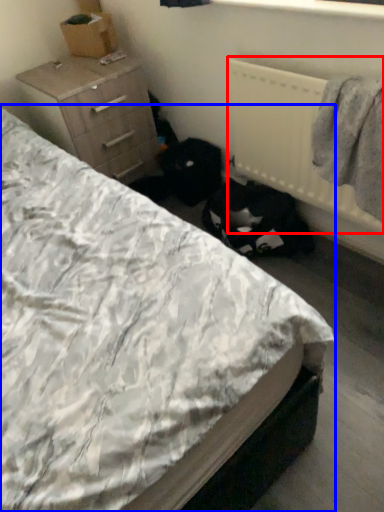
Question: Which point is closer to the camera, radiator (highlighted by a red box) or bed (highlighted by a blue box)?

Choices:
 (A) radiator
 (B) bed

Answer: (B)